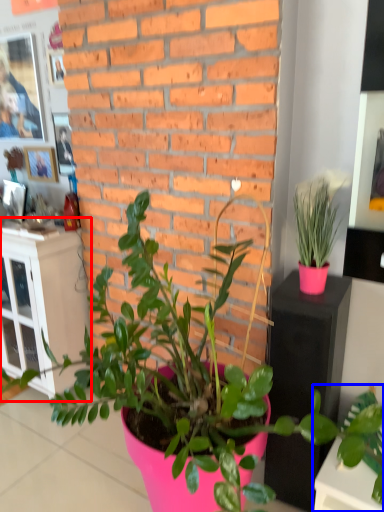
Question: Among these objects, which one is farthest to the camera, file cabinet (highlighted by a red box) or houseplant (highlighted by a blue box)?

Choices:
 (A) file cabinet
 (B) houseplant

Answer: (A)